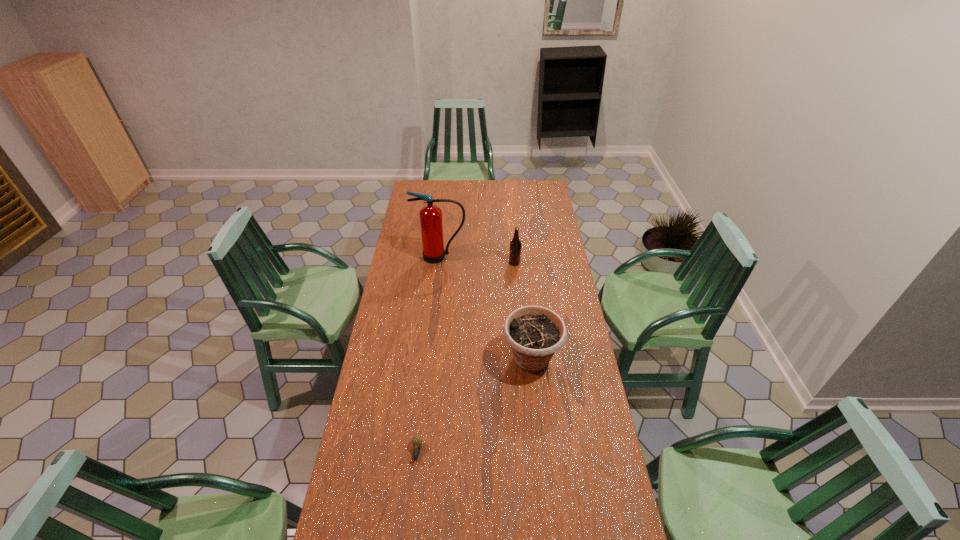
Find the location of a particular element. The height and width of the screenshot is (540, 960). free location that satisfies the following two spatial constraints: 1. on the back side of the flowerpot; 2. on the label of the beer bottle is located at coordinates (521, 263).